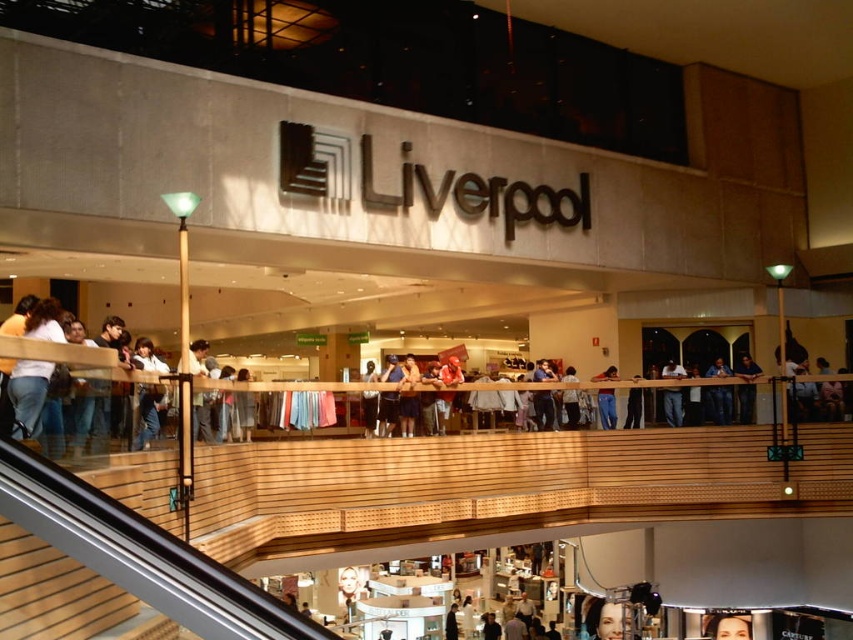
Question: Does light brown wooden railing at center appear on the right side of dark blue jeans at center?

Choices:
 (A) yes
 (B) no

Answer: (A)

Question: Is light brown wooden railing at center above dark blue jeans at center?

Choices:
 (A) no
 (B) yes

Answer: (B)

Question: Which point is closer to the camera taking this photo?

Choices:
 (A) (201, 342)
 (B) (19, 364)
 (C) (402, 376)

Answer: (B)

Question: Which point is farther to the camera?

Choices:
 (A) jeans at center
 (B) light brown wooden railing at center

Answer: (A)

Question: Does dark blue jeans at center appear under jeans at center?

Choices:
 (A) yes
 (B) no

Answer: (B)

Question: Which point is closer to the camera taking this photo?

Choices:
 (A) (604, 371)
 (B) (395, 376)
 (C) (177, 396)

Answer: (C)